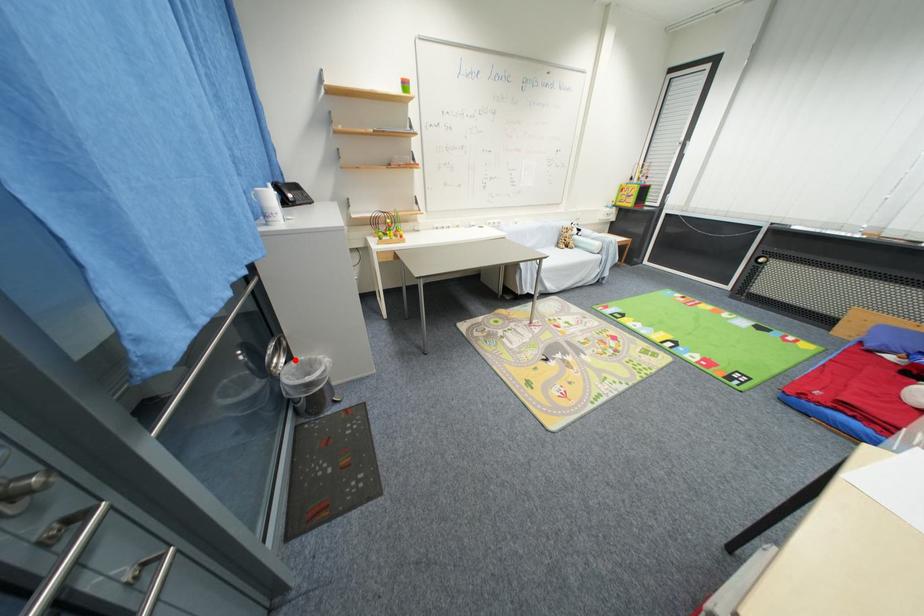
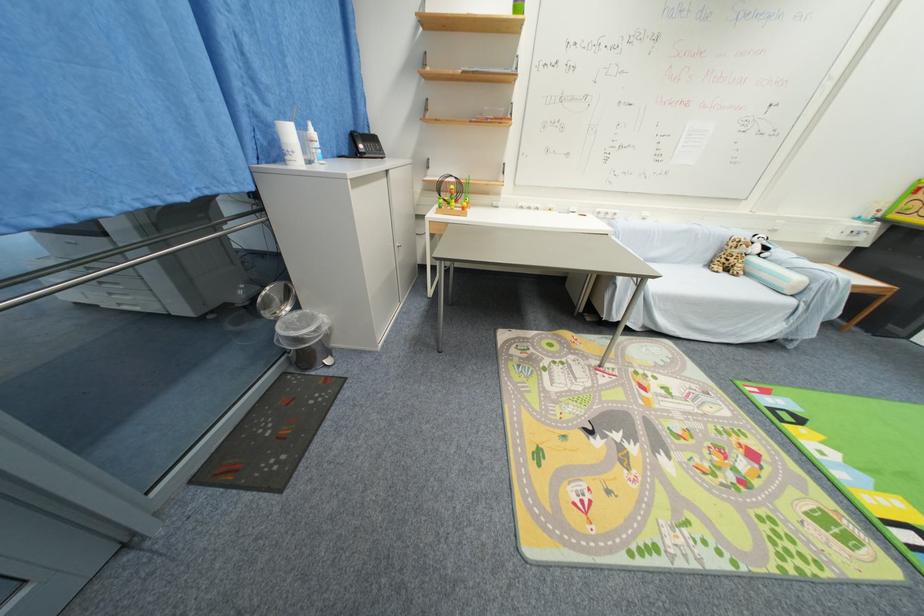
Where in the second image is the point corresponding to the highlighted location from the first image?

(301, 309)